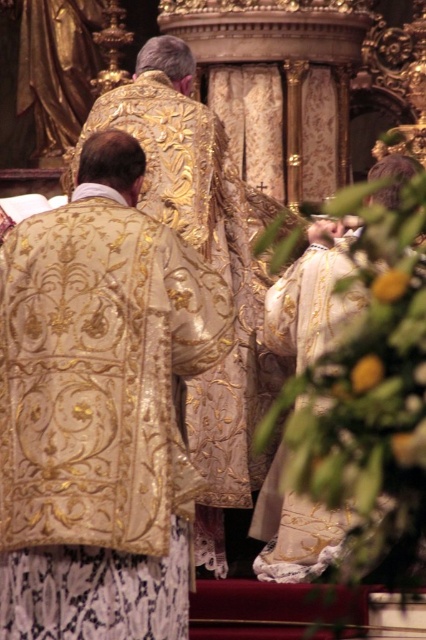
You are standing at the entrance of the church and see two robes in the center area. The gold embroidered robe at center and the white embroidered robe at center. Which robe is closer to you?

The gold embroidered robe at center is 42.11 feet away from the white embroidered robe at center. Since both are at the center area, their distance from you would depend on their positioning relative to each other. However, based on the description, the gold embroidered robe is positioned further away from the white embroidered robe, so the white embroidered robe at center is closer to you.

You are an assistant at the ceremony. You need to determine the correct order of the clergy members based on their vestments. Which robe is closer to the front, the gold embroidered robe at center or the white embroidered robe at center?

The gold embroidered robe at center is positioned under the white embroidered robe at center, meaning the white embroidered robe at center is closer to the front.